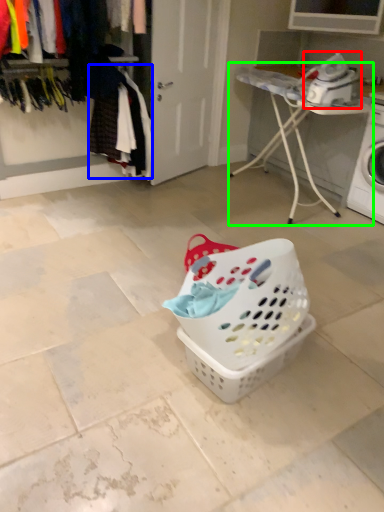
Question: Considering the real-world distances, which object is farthest from appliance (highlighted by a red box)? clothing (highlighted by a blue box) or furniture (highlighted by a green box)?

Choices:
 (A) clothing
 (B) furniture

Answer: (A)